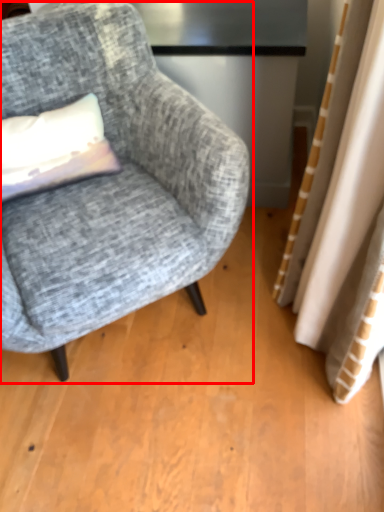
Question: In this image, where is chair (annotated by the red box) located relative to pillow?

Choices:
 (A) left
 (B) right

Answer: (B)